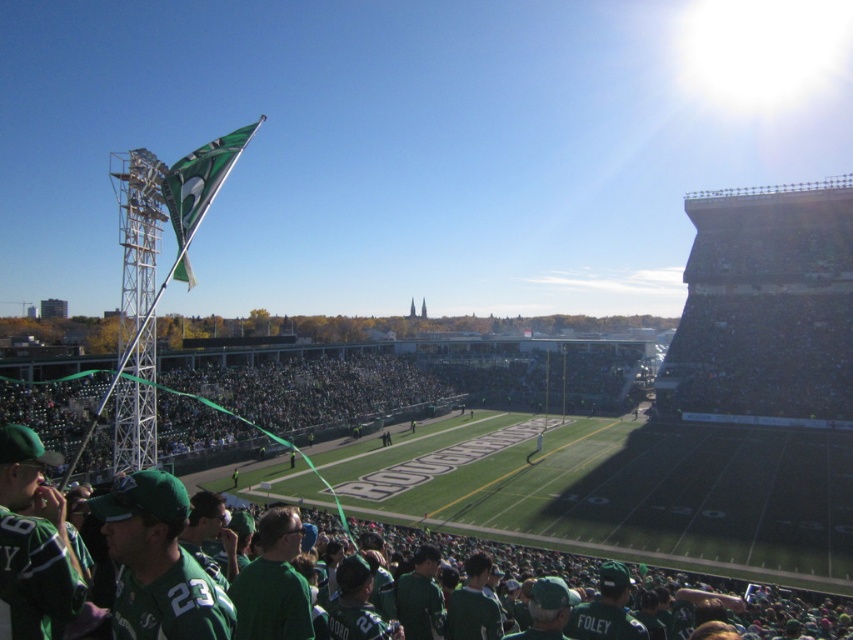
Question: Is green matte jersey at lower left wider than green fabric flag at upper left?

Choices:
 (A) no
 (B) yes

Answer: (A)

Question: Which of the following is the farthest from the observer?

Choices:
 (A) green matte jersey at lower left
 (B) green fabric flag at upper left

Answer: (B)

Question: Can you confirm if green matte jersey at lower left is positioned above green fabric flag at upper left?

Choices:
 (A) no
 (B) yes

Answer: (A)

Question: Among these points, which one is nearest to the camera?

Choices:
 (A) (167, 195)
 (B) (735, 516)

Answer: (A)

Question: Can you confirm if green matte jersey at lower left is wider than green fabric flag at upper left?

Choices:
 (A) no
 (B) yes

Answer: (A)